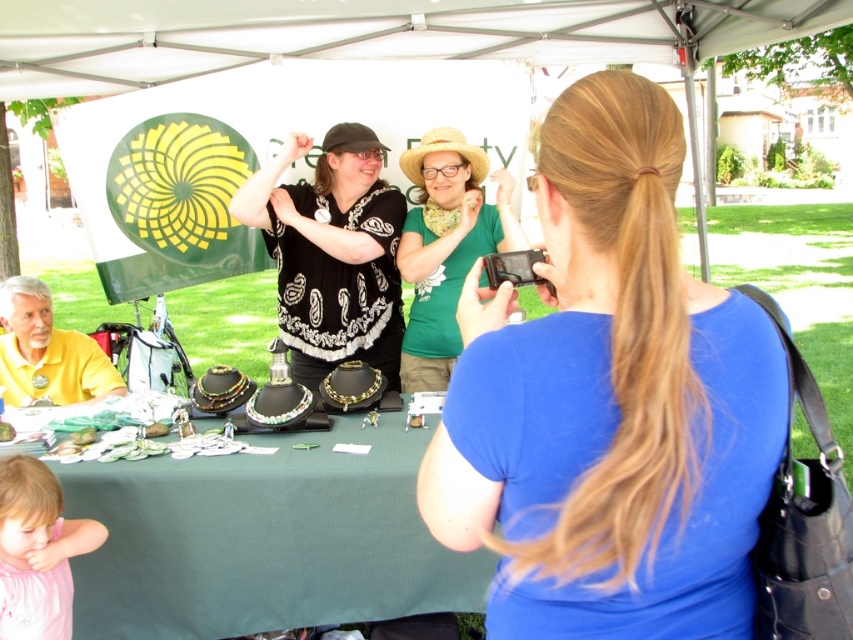
Question: Estimate the real-world distances between objects in this image. Which object is closer to the black paisley blouse at center?

Choices:
 (A) green matte shirt at center
 (B) pink fabric shirt at lower left
 (C) blue fabric shirt at center
 (D) green fabric table at lower center

Answer: (A)

Question: Does black paisley blouse at center lie behind yellow cotton shirt at left?

Choices:
 (A) yes
 (B) no

Answer: (A)

Question: Among these points, which one is nearest to the camera?

Choices:
 (A) (432, 230)
 (B) (480, 436)
 (C) (39, 328)

Answer: (B)

Question: Can you confirm if blue fabric shirt at center is bigger than green fabric table at lower center?

Choices:
 (A) no
 (B) yes

Answer: (A)

Question: Is green matte shirt at center to the right of yellow cotton shirt at left from the viewer's perspective?

Choices:
 (A) no
 (B) yes

Answer: (B)

Question: Based on their relative distances, which object is nearer to the yellow cotton shirt at left?

Choices:
 (A) blue fabric shirt at center
 (B) green fabric table at lower center
 (C) green matte shirt at center
 (D) pink fabric shirt at lower left

Answer: (B)